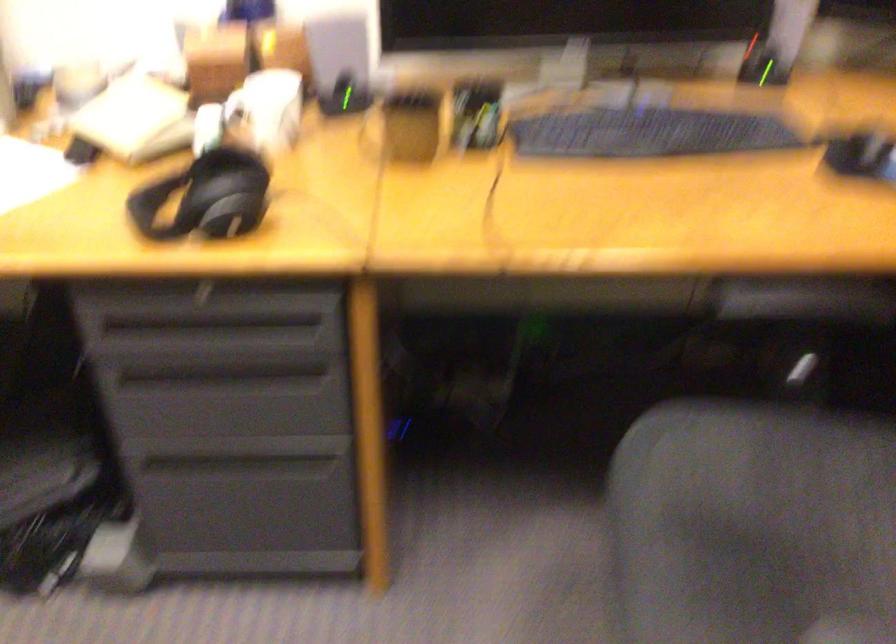
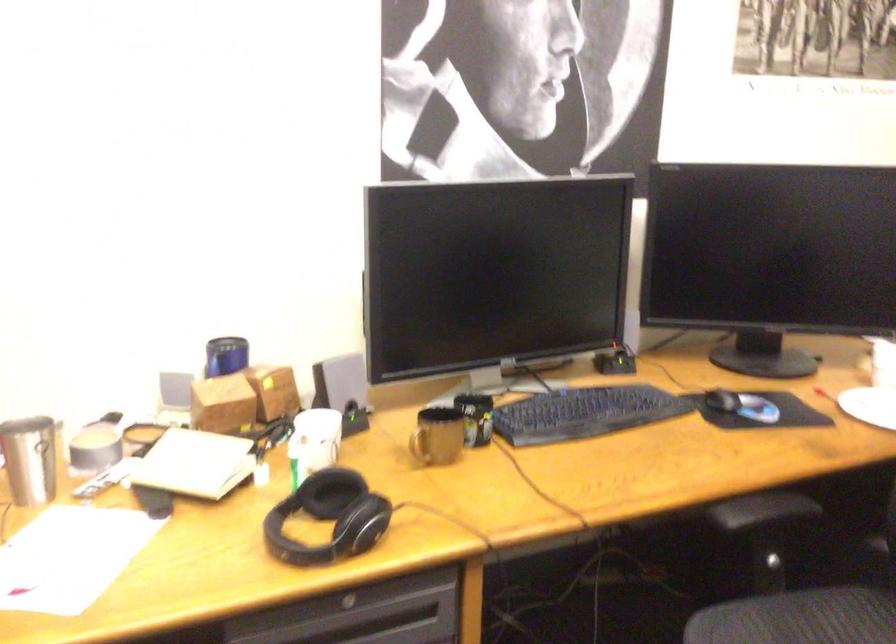
Where in the second image is the point corresponding to (x=125, y=117) from the first image?

(194, 464)